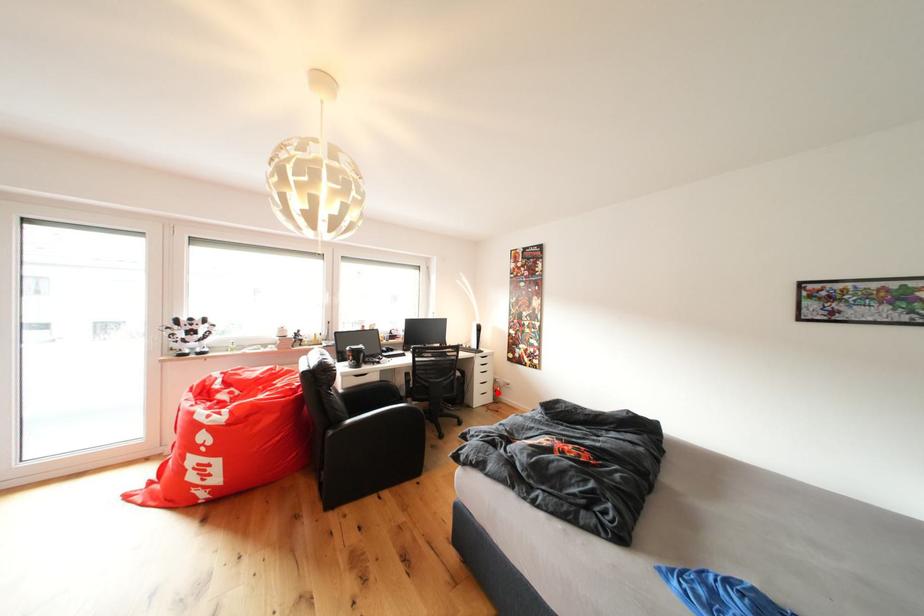
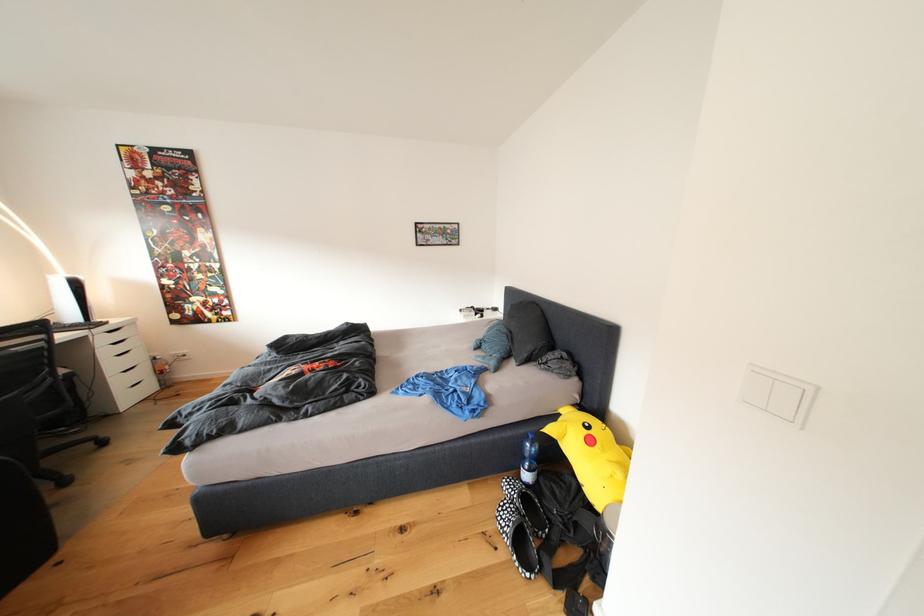
Find the pixel in the second image that matches the highlighted location in the first image.

(152, 379)